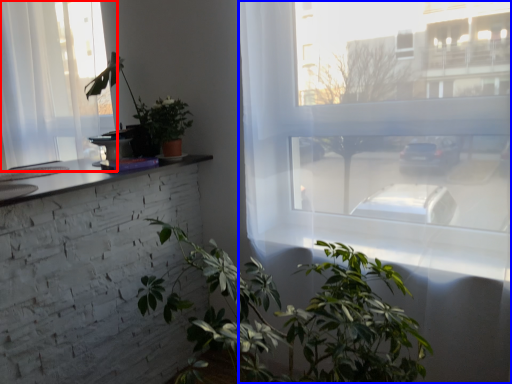
Question: Which point is closer to the camera, window (highlighted by a red box) or window (highlighted by a blue box)?

Choices:
 (A) window
 (B) window

Answer: (B)